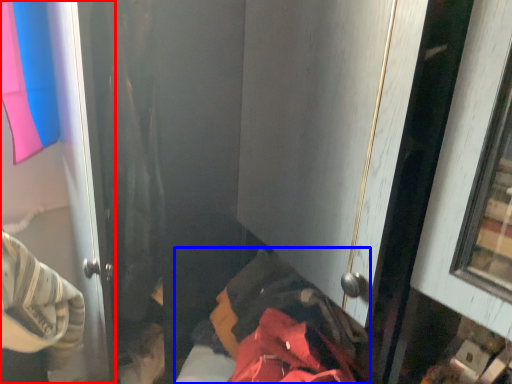
Question: Which object appears closest to the camera in this image, door (highlighted by a red box) or bed (highlighted by a blue box)?

Choices:
 (A) door
 (B) bed

Answer: (B)